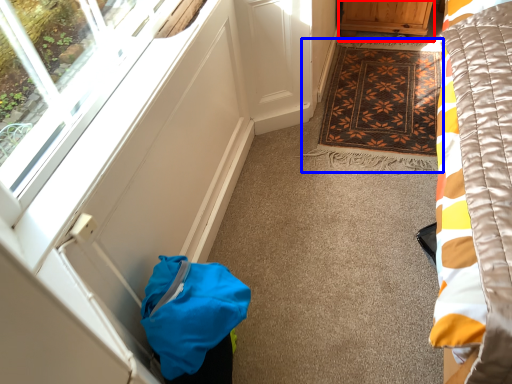
Question: Which of the following is the farthest to the observer, furniture (highlighted by a red box) or mat (highlighted by a blue box)?

Choices:
 (A) furniture
 (B) mat

Answer: (A)